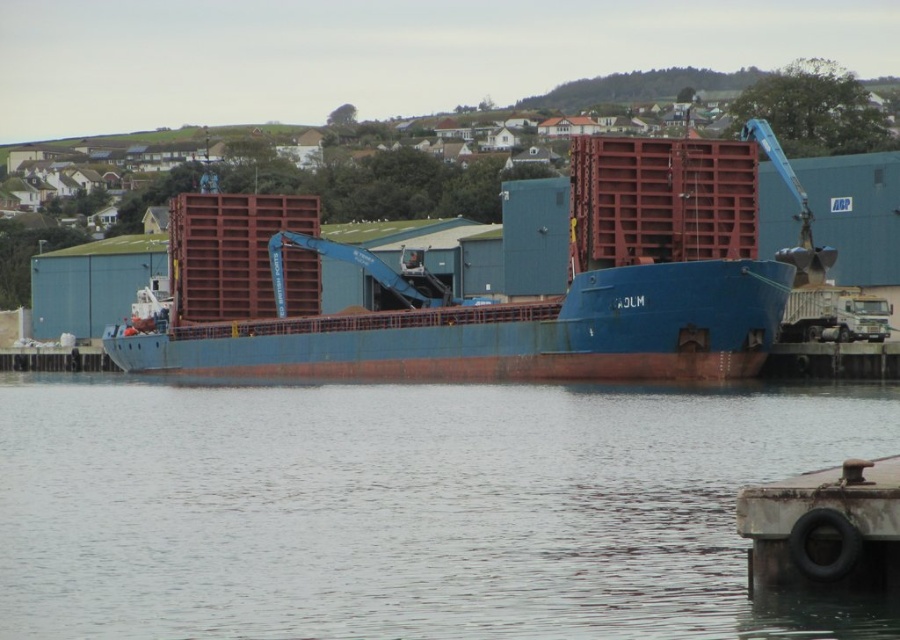
Can you confirm if transparent water at center is shorter than blue matte container ship at center?

Yes.

Who is more forward, [126,470] or [190,317]?

Positioned in front is point [126,470].

At what (x,y) coordinates should I click in order to perform the action: click on transparent water at center. Please return your answer as a coordinate pair (x, y). The width and height of the screenshot is (900, 640). Looking at the image, I should click on (406, 508).